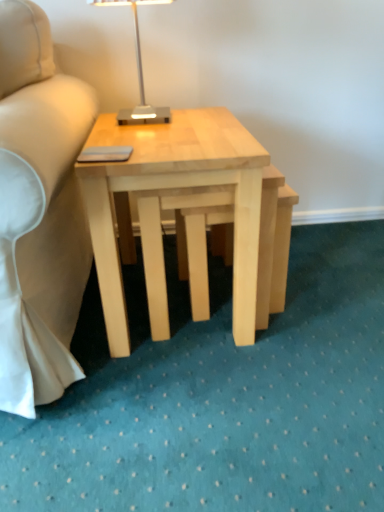
Image resolution: width=384 pixels, height=512 pixels. What are the coordinates of `vacant area that lies to the right of natural wood coffee table at center` in the screenshot? It's located at (336, 312).